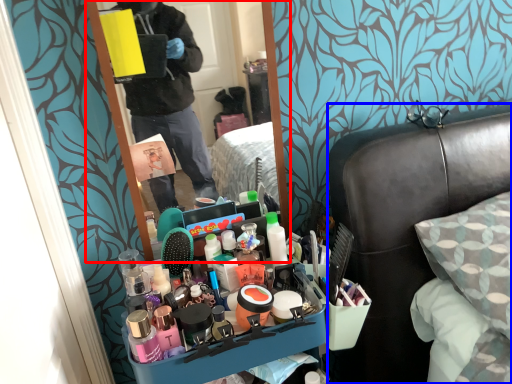
Question: Which point is further to the camera, mirror (highlighted by a red box) or furniture (highlighted by a blue box)?

Choices:
 (A) mirror
 (B) furniture

Answer: (A)